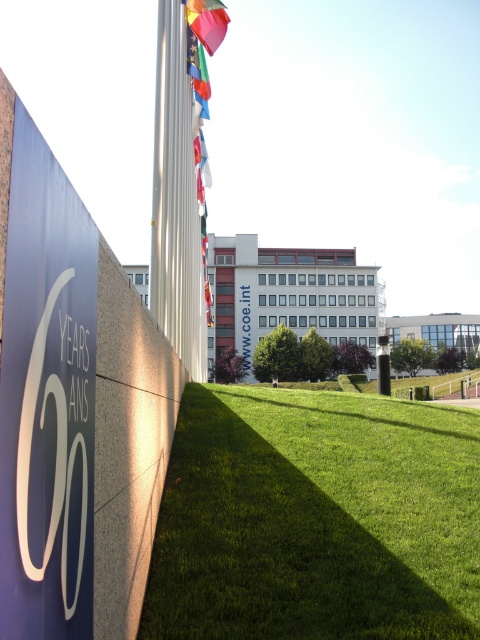
Can you confirm if green grass at lower center is thinner than white glossy logo at lower left?

No.

This screenshot has width=480, height=640. I want to click on green grass at lower center, so click(315, 518).

In order to click on green grass at lower center in this screenshot , I will do `click(315, 518)`.

Is green grass at lower center further to camera compared to silky fabric flag at upper center?

That is False.

Does green grass at lower center have a smaller size compared to silky fabric flag at upper center?

Correct, green grass at lower center occupies less space than silky fabric flag at upper center.

Is point (222, 568) positioned behind point (183, 0)?

No, (222, 568) is closer to viewer.

Find the location of a particular element. green grass at lower center is located at coordinates (315, 518).

Identify the location of white glossy logo at lower left. (56, 445).

Is white glossy logo at lower left thinner than silky fabric flag at upper center?

Yes, white glossy logo at lower left is thinner than silky fabric flag at upper center.

You are a GUI agent. You are given a task and a screenshot of the screen. Output one action in this format:
    pyautogui.click(x=<x>, y=<y>)
    Task: Click on the white glossy logo at lower left
    This screenshot has height=640, width=480.
    Given the screenshot: What is the action you would take?
    pyautogui.click(x=56, y=445)

At what (x,y) coordinates should I click in order to perform the action: click on white glossy logo at lower left. Please return your answer as a coordinate pair (x, y). This screenshot has height=640, width=480. Looking at the image, I should click on (56, 445).